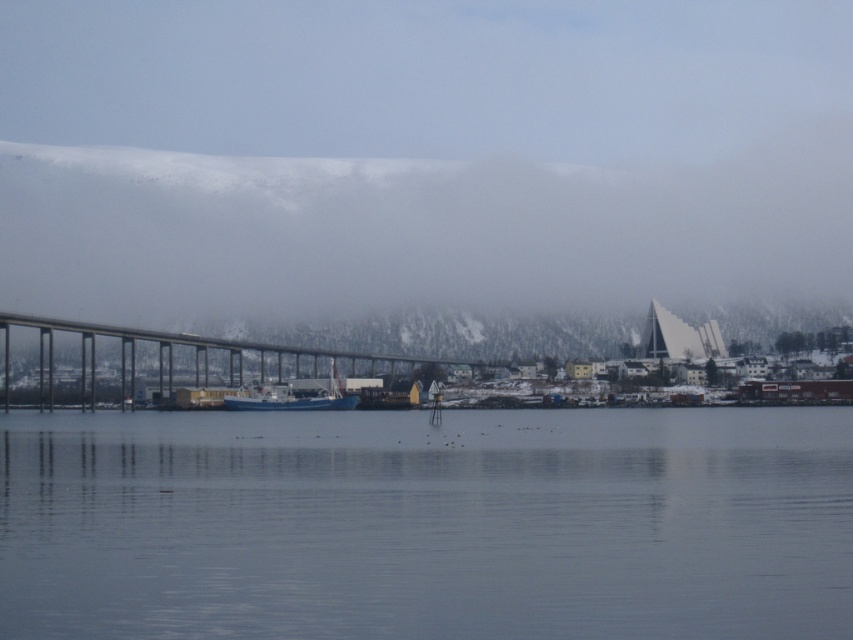
Which is in front, point (595, 614) or point (241, 401)?

Point (595, 614)

Between transparent water at center and blue matte boat at center, which one has more height?

transparent water at center is taller.

The height and width of the screenshot is (640, 853). Describe the element at coordinates (427, 524) in the screenshot. I see `transparent water at center` at that location.

What are the coordinates of `transparent water at center` in the screenshot? It's located at (427, 524).

Between transparent water at center and metallic gray bridge at center, which one is positioned higher?

Positioned higher is metallic gray bridge at center.

The width and height of the screenshot is (853, 640). In order to click on transparent water at center in this screenshot , I will do `click(427, 524)`.

Does metallic gray bridge at center lie in front of blue matte boat at center?

No, metallic gray bridge at center is further to the viewer.

Does metallic gray bridge at center appear over blue matte boat at center?

Yes.

Between point (16, 314) and point (350, 406), which one is positioned in front?

Point (350, 406)

Identify the location of metallic gray bridge at center. This screenshot has width=853, height=640. (195, 349).